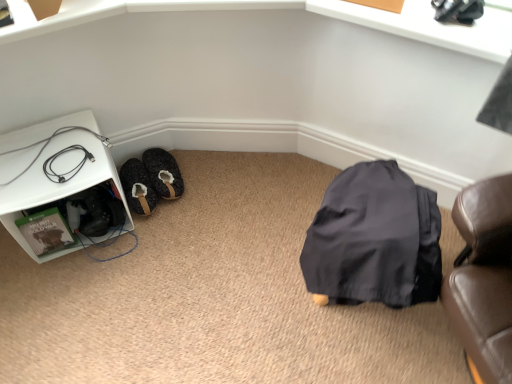
Question: From the image's perspective, relative to white plastic shelf at left, is fuzzy fabric slippers at lower left above or below?

Choices:
 (A) above
 (B) below

Answer: (A)

Question: Considering their positions, is fuzzy fabric slippers at lower left located in front of or behind white plastic shelf at left?

Choices:
 (A) behind
 (B) front

Answer: (A)

Question: Which object is positioned farthest from the fuzzy fabric slipper at lower left?

Choices:
 (A) black rubber cable at lower left
 (B) fuzzy fabric slippers at lower left
 (C) white plastic shelf at left

Answer: (A)

Question: Which object is positioned closest to the black rubber cable at lower left?

Choices:
 (A) white plastic shelf at left
 (B) fuzzy fabric slipper at lower left
 (C) fuzzy fabric slippers at lower left

Answer: (A)